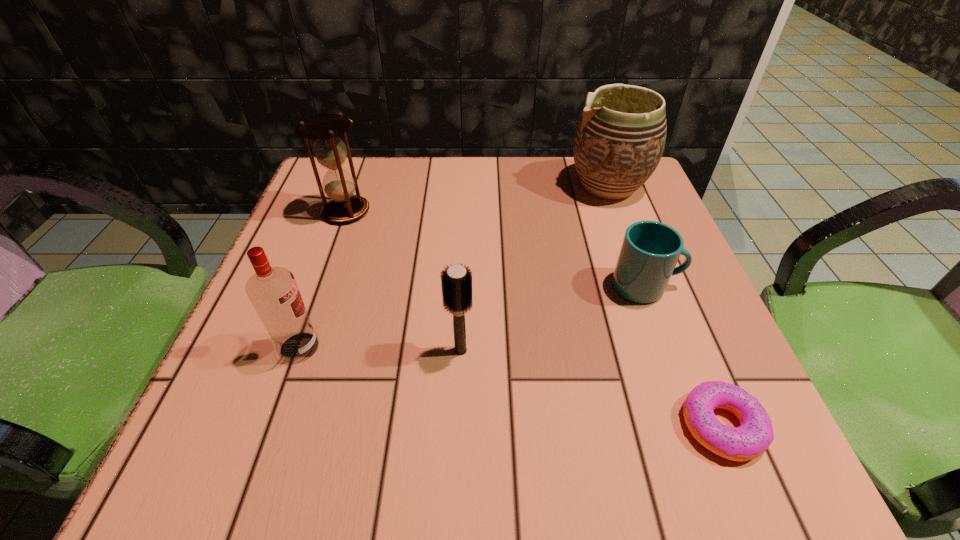
Locate an element on the screen. blank area in the image that satisfies the following two spatial constraints: 1. on the front side of the hourglass; 2. on the left side of the nearest object is located at coordinates coord(271,426).

The height and width of the screenshot is (540, 960). Identify the location of vacant space that satisfies the following two spatial constraints: 1. on the back side of the doughnut; 2. on the handle side of the fourth nearest object. (664, 286).